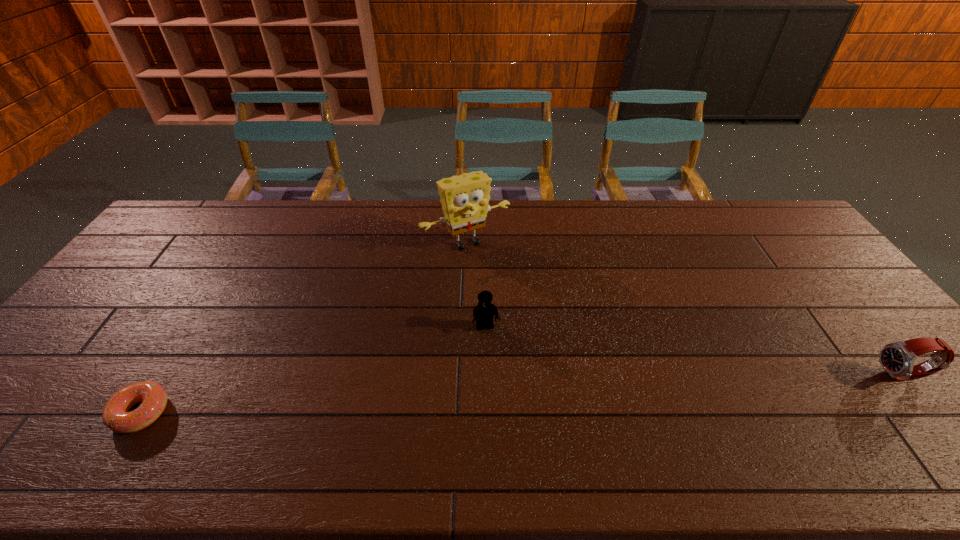
Identify the location of vacant space located on the face of the tallest object. (514, 295).

The height and width of the screenshot is (540, 960). Find the location of `free spot located on the face of the tallest object`. free spot located on the face of the tallest object is located at coordinates (524, 308).

You are a GUI agent. You are given a task and a screenshot of the screen. Output one action in this format:
    pyautogui.click(x=<x>, y=<y>)
    Task: Click on the free spot located on the face of the tallest object
    The height and width of the screenshot is (540, 960).
    Given the screenshot: What is the action you would take?
    pyautogui.click(x=525, y=310)

The image size is (960, 540). I want to click on vacant space situated on the front-facing side of the third nearest object, so click(503, 403).

Where is `free region located on the front-facing side of the third nearest object`? The height and width of the screenshot is (540, 960). free region located on the front-facing side of the third nearest object is located at coordinates (503, 403).

Find the location of a particular element. vacant space located on the front-facing side of the third nearest object is located at coordinates (498, 382).

At what (x,y) coordinates should I click in order to perform the action: click on object positioned at the far edge. Please return your answer as a coordinate pair (x, y). Looking at the image, I should click on (464, 198).

This screenshot has height=540, width=960. Find the location of `doughnut located in the near edge section of the desktop`. doughnut located in the near edge section of the desktop is located at coordinates (115, 416).

Identify the location of watch present at the near edge. The height and width of the screenshot is (540, 960). (898, 358).

You are a GUI agent. You are given a task and a screenshot of the screen. Output one action in this format:
    pyautogui.click(x=<x>, y=<y>)
    Task: Click on the object present at the right edge
    This screenshot has height=540, width=960.
    Given the screenshot: What is the action you would take?
    pyautogui.click(x=898, y=358)